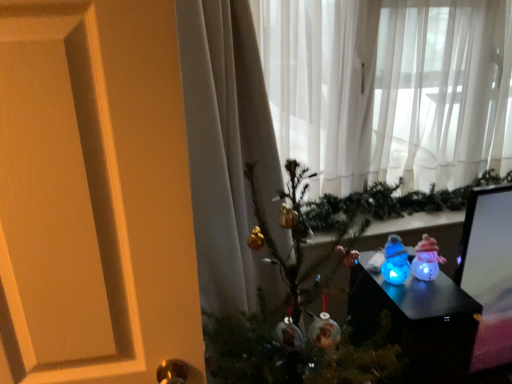
Locate an element on the screen. free spot above translucent plastic snowmen at lower right (from a real-world perspective) is located at coordinates (420, 284).